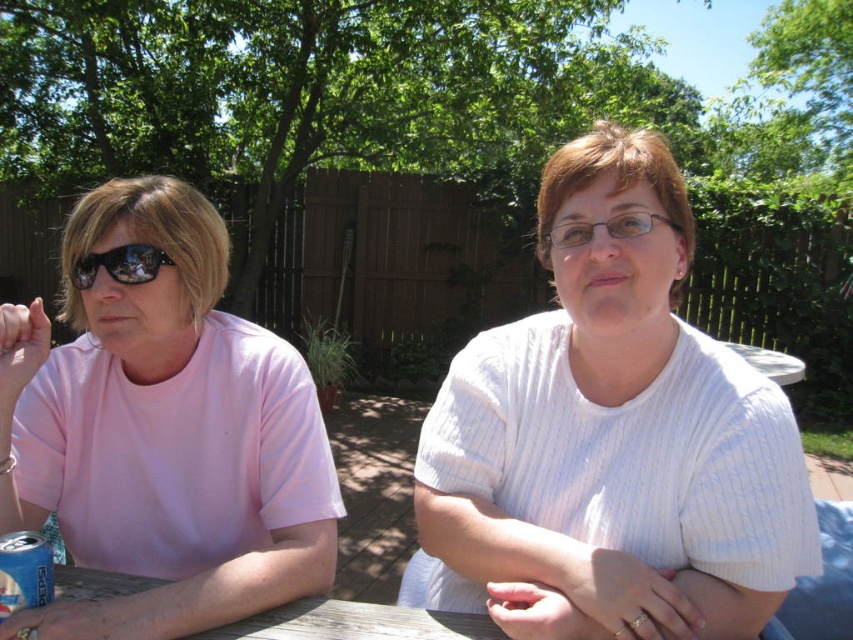
You are taking a photo of two people sitting under a tree. You notice two points in the image at coordinates point (273, 444) and point (131, 260). Which point is closer to the camera?

Point (131, 260) is closer to the camera because it is less further than point (273, 444).

You are planning to place a small potted plant that requires a 1.2 meter wide space. You see the wooden table at center and the blue metallic can at lower left. Which object can accommodate the plant?

The wooden table at center is larger in size than the blue metallic can at lower left, so the wooden table at center can accommodate the plant.

You are standing in the same area as the two people in the image. You need to hand a note to the person wearing the clear plastic glasses at center without disturbing the person in the pink matte shirt at left. Which direction should you approach from?

You should approach from the right side of the clear plastic glasses at center because the pink matte shirt at left is to the left of it, so approaching from the right avoids the person in the pink matte shirt at left.